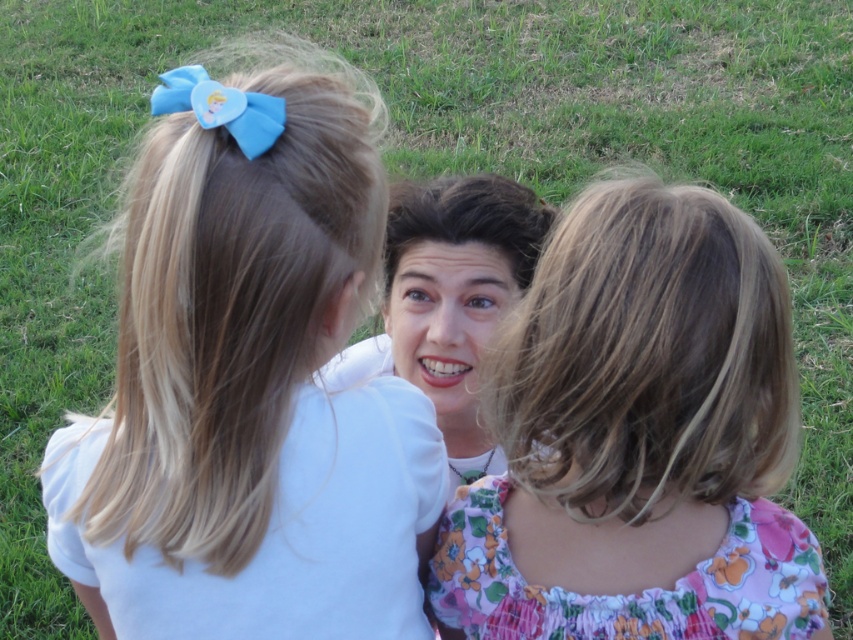
Can you confirm if blue fabric bow at upper left is taller than floral fabric dress at center?

Yes, blue fabric bow at upper left is taller than floral fabric dress at center.

Consider the image. Is blue fabric bow at upper left bigger than floral fabric dress at center?

Yes.

The width and height of the screenshot is (853, 640). What do you see at coordinates (248, 380) in the screenshot?
I see `blue fabric bow at upper left` at bounding box center [248, 380].

This screenshot has height=640, width=853. What are the coordinates of `blue fabric bow at upper left` in the screenshot? It's located at (248, 380).

Looking at this image, is smooth brown hair at center taller than dark brown silky hair at center?

Yes, smooth brown hair at center is taller than dark brown silky hair at center.

Can you confirm if smooth brown hair at center is wider than dark brown silky hair at center?

Yes, smooth brown hair at center is wider than dark brown silky hair at center.

Is point (476, 276) closer to camera compared to point (515, 241)?

Yes, point (476, 276) is in front of point (515, 241).

You are a GUI agent. You are given a task and a screenshot of the screen. Output one action in this format:
    pyautogui.click(x=<x>, y=<y>)
    Task: Click on the smooth brown hair at center
    
    Given the screenshot: What is the action you would take?
    pyautogui.click(x=450, y=300)

From the picture: Is floral fabric dress at center shorter than dark brown silky hair at center?

No.

Is floral fabric dress at center behind dark brown silky hair at center?

That is False.

Between point (653, 182) and point (497, 227), which one is positioned behind?

The point (497, 227) is more distant.

Identify the location of floral fabric dress at center. (639, 436).